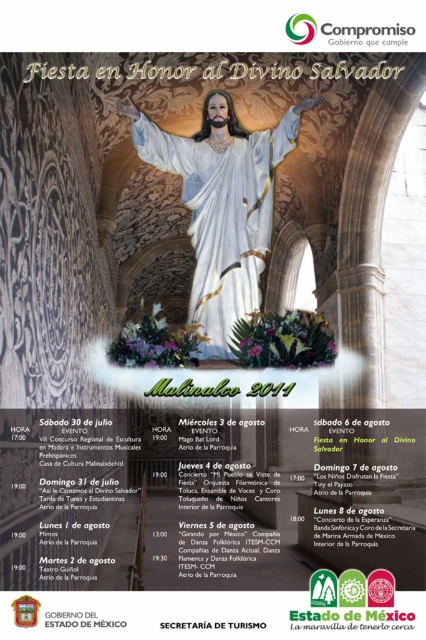
Question: Where is white marble statue at center located in relation to white paper at center in the image?

Choices:
 (A) above
 (B) below

Answer: (A)

Question: Can you confirm if white marble statue at center is positioned below white paper at center?

Choices:
 (A) no
 (B) yes

Answer: (A)

Question: Which object is closer to the camera taking this photo?

Choices:
 (A) white paper at center
 (B) white marble statue at center

Answer: (A)

Question: Does white marble statue at center appear under white paper at center?

Choices:
 (A) yes
 (B) no

Answer: (B)